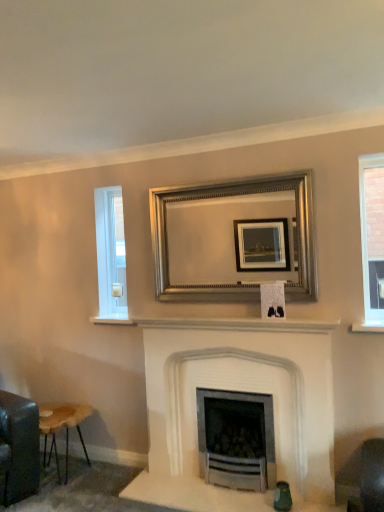
Question: Is wooden stool at lower left oriented away from white glass window at left, which is counted as the first window, starting from the left?

Choices:
 (A) yes
 (B) no

Answer: (B)

Question: From the image's perspective, would you say wooden stool at lower left is positioned over white glass window at left, which is counted as the first window, starting from the left?

Choices:
 (A) no
 (B) yes

Answer: (A)

Question: Does wooden stool at lower left appear on the right side of white glass window at left, which is the 1th window in back-to-front order?

Choices:
 (A) yes
 (B) no

Answer: (B)

Question: Considering the relative sizes of wooden stool at lower left and white glass window at left, which is the second window from front to back, in the image provided, is wooden stool at lower left shorter than white glass window at left, which is the second window from front to back,?

Choices:
 (A) no
 (B) yes

Answer: (B)

Question: Does wooden stool at lower left lie behind white glass window at left, which is counted as the first window, starting from the left?

Choices:
 (A) yes
 (B) no

Answer: (B)

Question: Based on their sizes in the image, would you say wooden stool at lower left is bigger or smaller than silver/golden metallic picture frame at center?

Choices:
 (A) small
 (B) big

Answer: (B)

Question: In terms of height, does wooden stool at lower left look taller or shorter compared to silver/golden metallic picture frame at center?

Choices:
 (A) tall
 (B) short

Answer: (B)

Question: Considering the positions of point (66, 413) and point (249, 197), is point (66, 413) closer or farther from the camera than point (249, 197)?

Choices:
 (A) closer
 (B) farther

Answer: (B)

Question: From a real-world perspective, is wooden stool at lower left physically located above or below silver/golden metallic picture frame at center?

Choices:
 (A) below
 (B) above

Answer: (A)

Question: From the image's perspective, is silver/golden metallic picture frame at center positioned above or below white glass window at left, which is counted as the first window, starting from the left?

Choices:
 (A) below
 (B) above

Answer: (B)

Question: Is silver/golden metallic picture frame at center in front of or behind white glass window at left, which is counted as the first window, starting from the left, in the image?

Choices:
 (A) behind
 (B) front

Answer: (B)

Question: From a real-world perspective, relative to white glass window at left, which is the 1th window in back-to-front order, is silver/golden metallic picture frame at center vertically above or below?

Choices:
 (A) above
 (B) below

Answer: (A)

Question: Is silver/golden metallic picture frame at center inside or outside of white glass window at left, which is the 1th window in back-to-front order?

Choices:
 (A) inside
 (B) outside

Answer: (B)

Question: Is white glass window at left, which is counted as the first window, starting from the left, wider or thinner than clear glass window at right, which is the first window from right to left?

Choices:
 (A) thin
 (B) wide

Answer: (A)

Question: Is point (105, 313) positioned closer to the camera than point (382, 172)?

Choices:
 (A) farther
 (B) closer

Answer: (A)